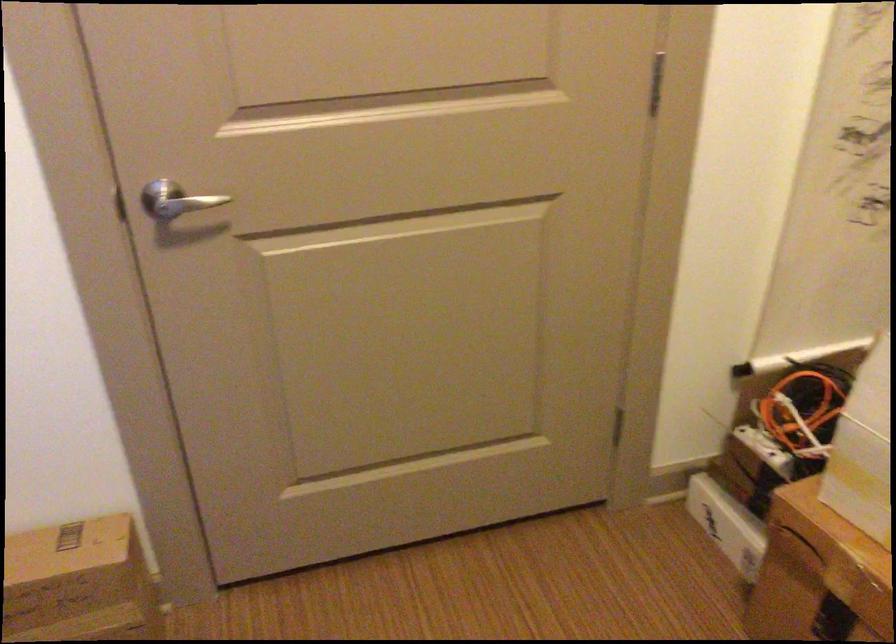
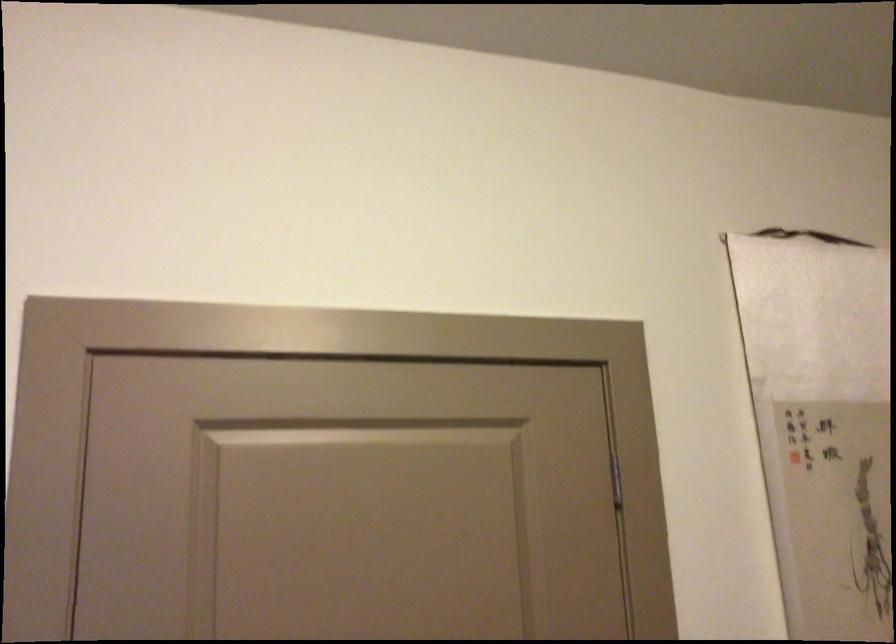
Question: Based on the continuous images, in which direction is the camera rotating? Reply with the corresponding letter.

Choices:
 (A) Left
 (B) Right
 (C) Up
 (D) Down

Answer: (C)